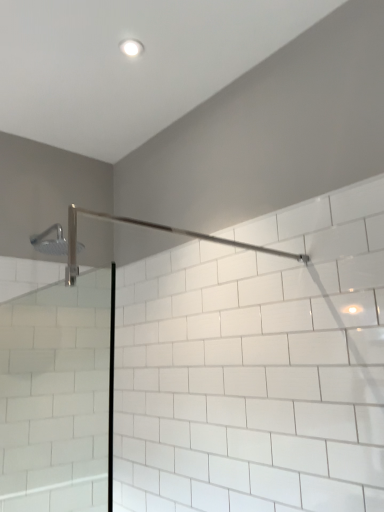
This screenshot has height=512, width=384. What do you see at coordinates (51, 242) in the screenshot?
I see `chrome metallic shower head at upper left` at bounding box center [51, 242].

This screenshot has width=384, height=512. I want to click on chrome metallic shower head at upper left, so click(x=51, y=242).

Find the location of a particular element. chrome metallic shower head at upper left is located at coordinates (51, 242).